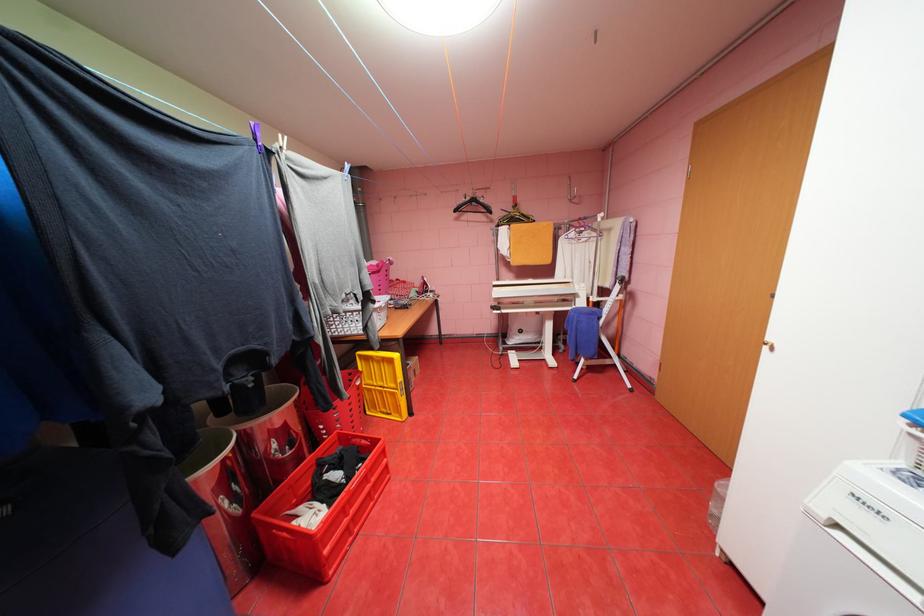
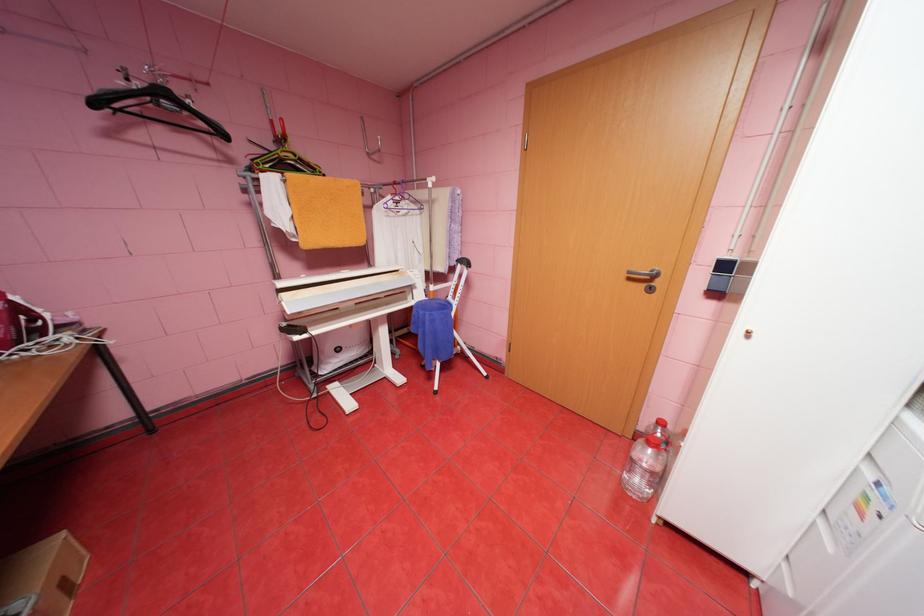
Where in the second image is the point corresponding to [464,209] from the first image?

(103, 103)